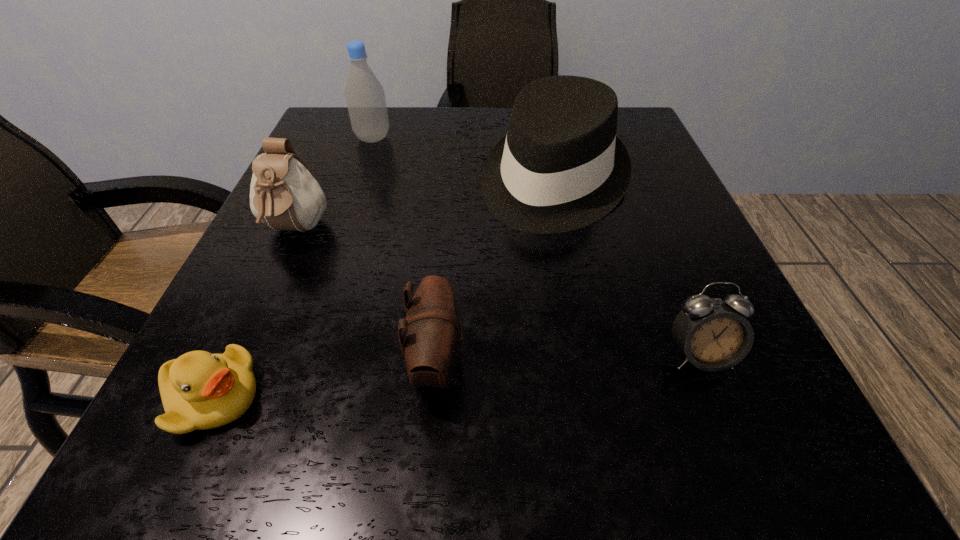
The height and width of the screenshot is (540, 960). In the image, there is a desktop. Find the location of `vacant space at the near left corner`. vacant space at the near left corner is located at coordinates (255, 424).

Locate an element on the screen. This screenshot has width=960, height=540. vacant space at the near right corner of the desktop is located at coordinates (770, 477).

Find the location of a particular element. The image size is (960, 540). vacant area between the taller pouch and the bottle is located at coordinates (334, 185).

The height and width of the screenshot is (540, 960). In order to click on unoccupied position between the fedora and the duckling in this screenshot , I will do `click(384, 289)`.

Locate an element on the screen. The width and height of the screenshot is (960, 540). unoccupied area between the tallest object and the shortest object is located at coordinates (293, 268).

The image size is (960, 540). Identify the location of free area in between the duckling and the fedora. (384, 289).

Locate an element on the screen. empty location between the nearer pouch and the bottle is located at coordinates (405, 251).

Locate an element on the screen. The image size is (960, 540). vacant region between the nearer pouch and the left pouch is located at coordinates (366, 297).

This screenshot has width=960, height=540. What are the coordinates of `free point between the bottle and the taller pouch` in the screenshot? It's located at coord(334,185).

What are the coordinates of `free space between the tallest object and the alarm clock` in the screenshot? It's located at pyautogui.click(x=536, y=247).